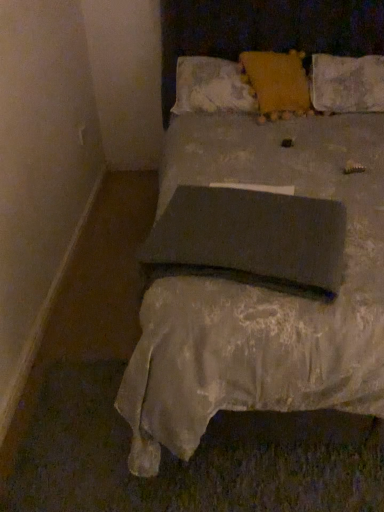
The image size is (384, 512). Find the location of `velvet orange pillow at upper center, the second pillow positioned from the front`. velvet orange pillow at upper center, the second pillow positioned from the front is located at coordinates (277, 83).

Where is `velvet orange pillow at upper center, the second pillow positioned from the front`? The height and width of the screenshot is (512, 384). velvet orange pillow at upper center, the second pillow positioned from the front is located at coordinates (277, 83).

Which object is positioned more to the right, fluffy white pillow at upper center, the 4th pillow viewed from the front, or matte gray bed at center?

Positioned to the right is matte gray bed at center.

Where is `the 2nd pillow to the left of the matte gray bed at center, counting from the anchor's position`? the 2nd pillow to the left of the matte gray bed at center, counting from the anchor's position is located at coordinates (211, 86).

Is fluffy white pillow at upper center, the first pillow viewed from the back, inside the boundaries of matte gray bed at center, or outside?

fluffy white pillow at upper center, the first pillow viewed from the back, is inside matte gray bed at center.

Is fluffy white pillow at upper center, the 4th pillow viewed from the front, taller than matte gray bed at center?

In fact, fluffy white pillow at upper center, the 4th pillow viewed from the front, may be shorter than matte gray bed at center.

Between textured beige pillow at upper right, which ranks as the 2th pillow in back-to-front order, and fluffy white pillow at upper center, the 4th pillow viewed from the front, which one has smaller width?

Thinner between the two is fluffy white pillow at upper center, the 4th pillow viewed from the front.

Does textured beige pillow at upper right, which ranks as the 2th pillow in back-to-front order, turn towards fluffy white pillow at upper center, the 4th pillow viewed from the front?

→ No, textured beige pillow at upper right, which ranks as the 2th pillow in back-to-front order, is not oriented towards fluffy white pillow at upper center, the 4th pillow viewed from the front.

Considering the positions of objects textured beige pillow at upper right, which ranks as the 2th pillow in back-to-front order, and fluffy white pillow at upper center, the first pillow viewed from the back, in the image provided, who is in front, textured beige pillow at upper right, which ranks as the 2th pillow in back-to-front order, or fluffy white pillow at upper center, the first pillow viewed from the back,?

textured beige pillow at upper right, which ranks as the 2th pillow in back-to-front order, is more forward.

Considering the positions of objects textured beige pillow at upper right, the third pillow positioned from the front, and fluffy white pillow at upper center, the first pillow viewed from the back, in the image provided, who is more to the left, textured beige pillow at upper right, the third pillow positioned from the front, or fluffy white pillow at upper center, the first pillow viewed from the back,?

Positioned to the left is fluffy white pillow at upper center, the first pillow viewed from the back.

From the image's perspective, between velvet orange pillow at upper center, which is counted as the 3th pillow, starting from the back, and dark gray fabric pillow at center, placed as the fourth pillow when sorted from back to front, which one is located above?

velvet orange pillow at upper center, which is counted as the 3th pillow, starting from the back, is shown above in the image.

From a real-world perspective, between velvet orange pillow at upper center, which is counted as the 3th pillow, starting from the back, and dark gray fabric pillow at center, placed as the fourth pillow when sorted from back to front, who is vertically lower?

In real-world perspective, dark gray fabric pillow at center, placed as the fourth pillow when sorted from back to front, is lower.

Would you consider velvet orange pillow at upper center, the second pillow positioned from the front, to be distant from dark gray fabric pillow at center, placed as the fourth pillow when sorted from back to front?

Yes.

Can you confirm if velvet orange pillow at upper center, the second pillow positioned from the front, is bigger than dark gray fabric pillow at center, placed as the fourth pillow when sorted from back to front?

Yes, velvet orange pillow at upper center, the second pillow positioned from the front, is bigger than dark gray fabric pillow at center, placed as the fourth pillow when sorted from back to front.

How different are the orientations of fluffy white pillow at upper center, the first pillow viewed from the back, and dark gray fabric pillow at center, the 1th pillow from the front, in degrees?

The facing directions of fluffy white pillow at upper center, the first pillow viewed from the back, and dark gray fabric pillow at center, the 1th pillow from the front, are 17.3 degrees apart.

From the picture: In the image, is fluffy white pillow at upper center, the first pillow viewed from the back, positioned in front of or behind dark gray fabric pillow at center, placed as the fourth pillow when sorted from back to front?

fluffy white pillow at upper center, the first pillow viewed from the back, is positioned farther from the viewer than dark gray fabric pillow at center, placed as the fourth pillow when sorted from back to front.

Considering the relative sizes of fluffy white pillow at upper center, the 4th pillow viewed from the front, and dark gray fabric pillow at center, the 1th pillow from the front, in the image provided, is fluffy white pillow at upper center, the 4th pillow viewed from the front, smaller than dark gray fabric pillow at center, the 1th pillow from the front,?

No.

Who is taller, fluffy white pillow at upper center, the first pillow viewed from the back, or dark gray fabric pillow at center, placed as the fourth pillow when sorted from back to front?

Standing taller between the two is fluffy white pillow at upper center, the first pillow viewed from the back.

Which of these two, dark gray fabric pillow at center, the 1th pillow from the front, or textured beige pillow at upper right, which ranks as the 2th pillow in back-to-front order, stands shorter?

dark gray fabric pillow at center, the 1th pillow from the front.

Is dark gray fabric pillow at center, the 1th pillow from the front, facing towards textured beige pillow at upper right, the third pillow positioned from the front?

No.

In the scene shown: Can you confirm if dark gray fabric pillow at center, the 1th pillow from the front, is bigger than textured beige pillow at upper right, which ranks as the 2th pillow in back-to-front order?

Incorrect, dark gray fabric pillow at center, the 1th pillow from the front, is not larger than textured beige pillow at upper right, which ranks as the 2th pillow in back-to-front order.

Is dark gray fabric pillow at center, placed as the fourth pillow when sorted from back to front, far from textured beige pillow at upper right, which ranks as the 2th pillow in back-to-front order?

dark gray fabric pillow at center, placed as the fourth pillow when sorted from back to front, is far away from textured beige pillow at upper right, which ranks as the 2th pillow in back-to-front order.

Looking at this image, is matte gray bed at center completely or partially outside of textured beige pillow at upper right, which ranks as the 2th pillow in back-to-front order?

Yes, matte gray bed at center is outside of textured beige pillow at upper right, which ranks as the 2th pillow in back-to-front order.

Are matte gray bed at center and textured beige pillow at upper right, the third pillow positioned from the front, making contact?

They are not placed beside each other.

Looking at the image, does matte gray bed at center seem bigger or smaller compared to textured beige pillow at upper right, which ranks as the 2th pillow in back-to-front order?

matte gray bed at center is bigger than textured beige pillow at upper right, which ranks as the 2th pillow in back-to-front order.

Is matte gray bed at center shorter than textured beige pillow at upper right, which ranks as the 2th pillow in back-to-front order?

Incorrect, the height of matte gray bed at center does not fall short of that of textured beige pillow at upper right, which ranks as the 2th pillow in back-to-front order.

Is velvet orange pillow at upper center, which is counted as the 3th pillow, starting from the back, bigger than matte gray bed at center?

Incorrect, velvet orange pillow at upper center, which is counted as the 3th pillow, starting from the back, is not larger than matte gray bed at center.

Is velvet orange pillow at upper center, which is counted as the 3th pillow, starting from the back, shorter than matte gray bed at center?

Yes, velvet orange pillow at upper center, which is counted as the 3th pillow, starting from the back, is shorter than matte gray bed at center.

Considering the relative sizes of velvet orange pillow at upper center, the second pillow positioned from the front, and matte gray bed at center in the image provided, is velvet orange pillow at upper center, the second pillow positioned from the front, wider than matte gray bed at center?

Incorrect, the width of velvet orange pillow at upper center, the second pillow positioned from the front, does not surpass that of matte gray bed at center.

Does velvet orange pillow at upper center, the second pillow positioned from the front, appear on the right side of matte gray bed at center?

Incorrect, velvet orange pillow at upper center, the second pillow positioned from the front, is not on the right side of matte gray bed at center.

The width and height of the screenshot is (384, 512). I want to click on the 2nd pillow to the left of the matte gray bed at center, starting your count from the anchor, so click(x=211, y=86).

This screenshot has height=512, width=384. Identify the location of the 2nd pillow to the right of the fluffy white pillow at upper center, the first pillow viewed from the back, starting your count from the anchor. (347, 84).

Looking at the image, which one is located further to matte gray bed at center, textured beige pillow at upper right, the third pillow positioned from the front, or fluffy white pillow at upper center, the 4th pillow viewed from the front?

textured beige pillow at upper right, the third pillow positioned from the front, is further to matte gray bed at center.

Considering their positions, is textured beige pillow at upper right, the third pillow positioned from the front, positioned closer to fluffy white pillow at upper center, the first pillow viewed from the back, than velvet orange pillow at upper center, the second pillow positioned from the front?

velvet orange pillow at upper center, the second pillow positioned from the front, is closer to fluffy white pillow at upper center, the first pillow viewed from the back.

Which object lies further to the anchor point matte gray bed at center, textured beige pillow at upper right, which ranks as the 2th pillow in back-to-front order, or velvet orange pillow at upper center, which is counted as the 3th pillow, starting from the back?

Among the two, textured beige pillow at upper right, which ranks as the 2th pillow in back-to-front order, is located further to matte gray bed at center.

Looking at the image, which one is located further to matte gray bed at center, textured beige pillow at upper right, the third pillow positioned from the front, or dark gray fabric pillow at center, the 1th pillow from the front?

textured beige pillow at upper right, the third pillow positioned from the front, lies further to matte gray bed at center than the other object.

Which object lies nearer to the anchor point fluffy white pillow at upper center, the 4th pillow viewed from the front, dark gray fabric pillow at center, the 1th pillow from the front, or textured beige pillow at upper right, the third pillow positioned from the front?

Among the two, textured beige pillow at upper right, the third pillow positioned from the front, is located nearer to fluffy white pillow at upper center, the 4th pillow viewed from the front.

Looking at this image, which object lies further to the anchor point fluffy white pillow at upper center, the 4th pillow viewed from the front, matte gray bed at center or dark gray fabric pillow at center, the 1th pillow from the front?

dark gray fabric pillow at center, the 1th pillow from the front, lies further to fluffy white pillow at upper center, the 4th pillow viewed from the front, than the other object.

From the image, which object appears to be farther from dark gray fabric pillow at center, the 1th pillow from the front, velvet orange pillow at upper center, the second pillow positioned from the front, or matte gray bed at center?

velvet orange pillow at upper center, the second pillow positioned from the front, lies further to dark gray fabric pillow at center, the 1th pillow from the front, than the other object.

Looking at the image, which one is located closer to fluffy white pillow at upper center, the first pillow viewed from the back, textured beige pillow at upper right, the third pillow positioned from the front, or dark gray fabric pillow at center, the 1th pillow from the front?

Among the two, textured beige pillow at upper right, the third pillow positioned from the front, is located nearer to fluffy white pillow at upper center, the first pillow viewed from the back.

Locate an element on the screen. Image resolution: width=384 pixels, height=512 pixels. pillow positioned between dark gray fabric pillow at center, the 1th pillow from the front, and textured beige pillow at upper right, which ranks as the 2th pillow in back-to-front order, from near to far is located at coordinates (277, 83).

The height and width of the screenshot is (512, 384). I want to click on pillow between matte gray bed at center and velvet orange pillow at upper center, the second pillow positioned from the front, in the front-back direction, so click(x=249, y=239).

At what (x,y) coordinates should I click in order to perform the action: click on pillow situated between fluffy white pillow at upper center, the 4th pillow viewed from the front, and textured beige pillow at upper right, the third pillow positioned from the front, from left to right. Please return your answer as a coordinate pair (x, y). Looking at the image, I should click on (277, 83).